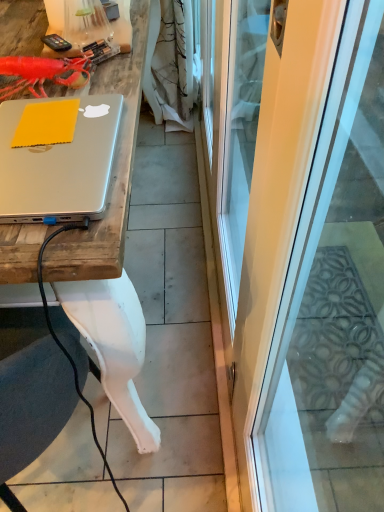
Question: Is silver metallic desk at upper left inside rubberized plastic lobster at upper left?

Choices:
 (A) yes
 (B) no

Answer: (B)

Question: Does rubberized plastic lobster at upper left have a greater height compared to silver metallic desk at upper left?

Choices:
 (A) no
 (B) yes

Answer: (B)

Question: Does rubberized plastic lobster at upper left turn towards silver metallic desk at upper left?

Choices:
 (A) yes
 (B) no

Answer: (B)

Question: Is rubberized plastic lobster at upper left shorter than silver metallic desk at upper left?

Choices:
 (A) yes
 (B) no

Answer: (B)

Question: Is rubberized plastic lobster at upper left facing away from silver metallic desk at upper left?

Choices:
 (A) yes
 (B) no

Answer: (B)

Question: Are rubberized plastic lobster at upper left and silver metallic desk at upper left far apart?

Choices:
 (A) no
 (B) yes

Answer: (A)

Question: Can you confirm if transparent glass screen door at center is bigger than rubberized plastic lobster at upper left?

Choices:
 (A) no
 (B) yes

Answer: (B)

Question: Is transparent glass screen door at center further to the viewer compared to rubberized plastic lobster at upper left?

Choices:
 (A) yes
 (B) no

Answer: (B)

Question: Does transparent glass screen door at center have a lesser width compared to rubberized plastic lobster at upper left?

Choices:
 (A) no
 (B) yes

Answer: (B)

Question: Can you confirm if transparent glass screen door at center is shorter than rubberized plastic lobster at upper left?

Choices:
 (A) no
 (B) yes

Answer: (A)

Question: Does transparent glass screen door at center have a greater width compared to rubberized plastic lobster at upper left?

Choices:
 (A) yes
 (B) no

Answer: (B)

Question: Is transparent glass screen door at center closer to camera compared to rubberized plastic lobster at upper left?

Choices:
 (A) yes
 (B) no

Answer: (A)

Question: Is silver metallic desk at upper left far from matte silver laptop at upper left?

Choices:
 (A) no
 (B) yes

Answer: (A)